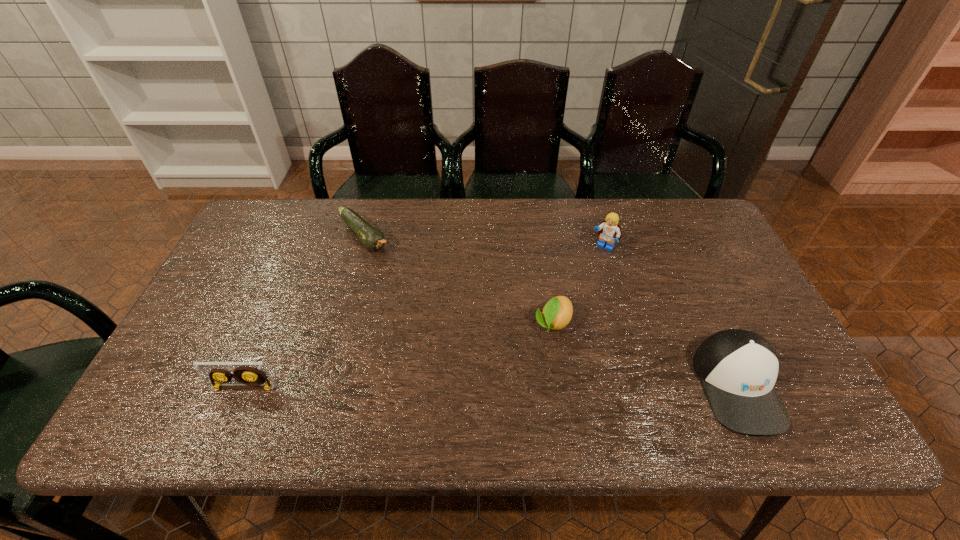
Find the location of a particular element. The height and width of the screenshot is (540, 960). blank area located on the front-facing side of the Lego is located at coordinates (559, 310).

Where is `vacant space situated on the front-facing side of the Lego`? The image size is (960, 540). vacant space situated on the front-facing side of the Lego is located at coordinates [x=566, y=299].

The image size is (960, 540). In order to click on free spot located on the front-facing side of the Lego in this screenshot , I will do `click(582, 277)`.

The image size is (960, 540). What are the coordinates of `vacant space located at the blossom end of the fourth object from right to left` in the screenshot? It's located at (405, 283).

Identify the location of vacant space located at the blossom end of the fourth object from right to left. point(386,261).

Identify the location of free region located at the blossom end of the fourth object from right to left. (396, 273).

Identify the location of Lego situated at the far edge. (609, 229).

Find the location of a particular element. The width and height of the screenshot is (960, 540). zucchini present at the far edge is located at coordinates (372, 238).

Locate an element on the screen. videotape present at the near edge is located at coordinates (248, 375).

Identify the location of cap that is at the near edge. (738, 369).